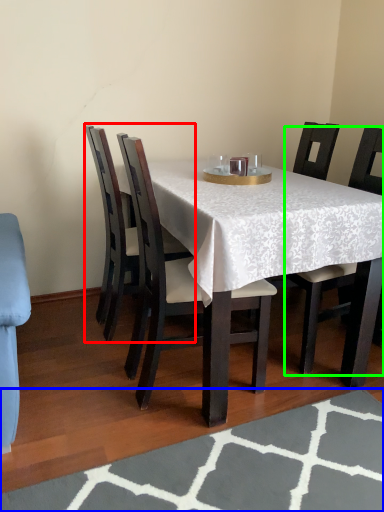
Question: Which is farther away from chair (highlighted by a red box)? place mat (highlighted by a blue box) or chair (highlighted by a green box)?

Choices:
 (A) place mat
 (B) chair

Answer: (A)